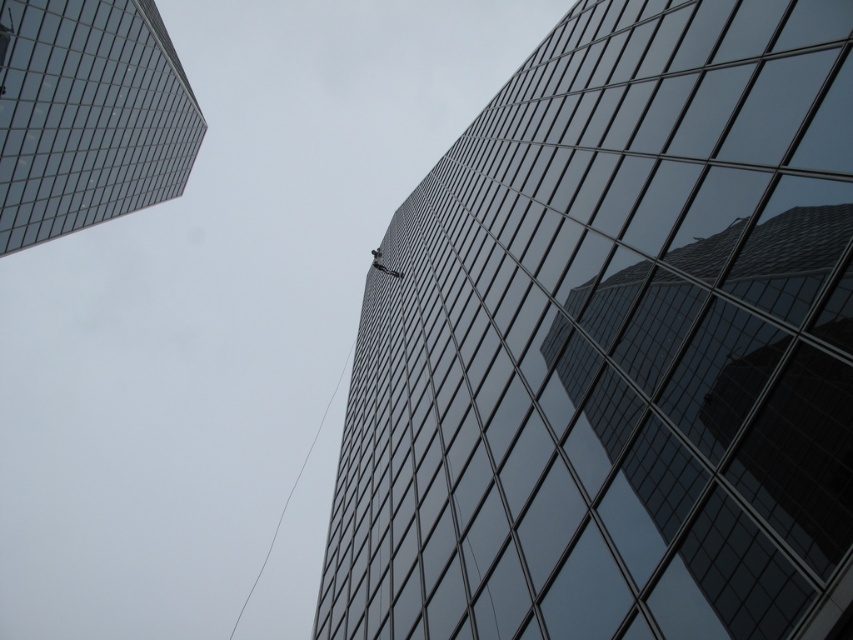
From the picture: You are a drone operator tasked with flying a drone between the two buildings. The drone has a wingspan of 1.2 meters. Based on the scene, can you determine if there is enough space between the glossy glass building at center and the transparent glass skyscraper at upper left for the drone to pass through?

The glossy glass building at center might be wider than transparent glass skyscraper at upper left, so the distance between them is uncertain. Without exact measurements, it is not possible to confirm if the 1.2 meter wingspan drone can safely pass through.

You are standing at the base of the skyscrapers and want to take a photo of the glossy glass building at center. According to the coordinates given, where should you position yourself to capture the entire building in your camera frame?

The glossy glass building at center is located at coordinates point (614, 346), so you should position yourself directly in front of it to capture the entire building within your camera frame.

You are standing at the base of the two glass buildings. Which building, the glossy glass building at center or the transparent glass skyscraper at upper left, would block your view of the sky if you look upward?

The glossy glass building at center is in front of the transparent glass skyscraper at upper left, so it would block your view of the sky when looking upward.